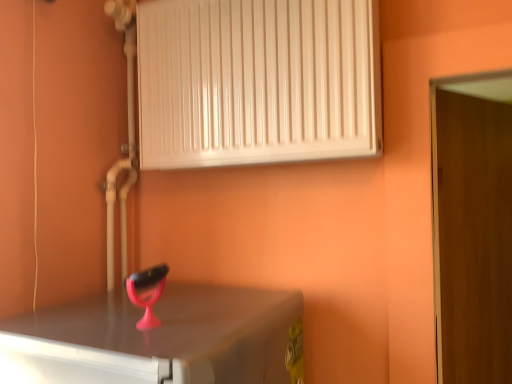
This screenshot has height=384, width=512. What do you see at coordinates (472, 226) in the screenshot? I see `wooden door at right` at bounding box center [472, 226].

At what (x,y) coordinates should I click in order to perform the action: click on wooden door at right. Please return your answer as a coordinate pair (x, y). The width and height of the screenshot is (512, 384). Looking at the image, I should click on (472, 226).

The height and width of the screenshot is (384, 512). What do you see at coordinates (257, 81) in the screenshot?
I see `white glossy radiator at upper center` at bounding box center [257, 81].

Find the location of `white glossy radiator at upper center`. white glossy radiator at upper center is located at coordinates (257, 81).

Find the location of a particular element. This screenshot has height=384, width=512. wooden door at right is located at coordinates (472, 226).

Considering the relative positions of wooden door at right and white glossy radiator at upper center in the image provided, is wooden door at right to the right of white glossy radiator at upper center from the viewer's perspective?

Yes.

Which object is closer to the camera, wooden door at right or white glossy radiator at upper center?

white glossy radiator at upper center is more forward.

Is point (463, 238) positioned behind point (237, 121)?

Yes, point (463, 238) is behind point (237, 121).

From the image's perspective, which one is positioned lower, wooden door at right or white glossy radiator at upper center?

wooden door at right is shown below in the image.

From a real-world perspective, is wooden door at right on top of white glossy radiator at upper center?

No.

Is wooden door at right thinner than white glossy radiator at upper center?

Correct, the width of wooden door at right is less than that of white glossy radiator at upper center.

Who is taller, wooden door at right or white glossy radiator at upper center?

wooden door at right.

From the picture: Is wooden door at right smaller than white glossy radiator at upper center?

Actually, wooden door at right might be larger than white glossy radiator at upper center.

In the scene shown: Is wooden door at right inside the boundaries of white glossy radiator at upper center, or outside?

wooden door at right cannot be found inside white glossy radiator at upper center.

Is wooden door at right far from white glossy radiator at upper center?

No, wooden door at right is not far from white glossy radiator at upper center.

Is wooden door at right looking in the opposite direction of white glossy radiator at upper center?

wooden door at right does not have its back to white glossy radiator at upper center.

From the picture: How many degrees apart are the facing directions of wooden door at right and white glossy radiator at upper center?

The angular difference between wooden door at right and white glossy radiator at upper center is 68.2 degrees.

At what (x,y) coordinates should I click in order to perform the action: click on radiator above the wooden door at right (from the image's perspective). Please return your answer as a coordinate pair (x, y). Looking at the image, I should click on (257, 81).

Is white glossy radiator at upper center at the left side of wooden door at right?

Indeed, white glossy radiator at upper center is positioned on the left side of wooden door at right.

Is white glossy radiator at upper center in front of or behind wooden door at right in the image?

Visually, white glossy radiator at upper center is located in front of wooden door at right.

Considering the positions of points (321, 90) and (454, 81), is point (321, 90) closer to camera compared to point (454, 81)?

No, (321, 90) is behind (454, 81).

From the image's perspective, would you say white glossy radiator at upper center is shown under wooden door at right?

Incorrect, from the image's perspective, white glossy radiator at upper center is higher than wooden door at right.

From a real-world perspective, between white glossy radiator at upper center and wooden door at right, who is vertically higher?

In real-world perspective, white glossy radiator at upper center is above.

Between white glossy radiator at upper center and wooden door at right, which one has smaller width?

With smaller width is wooden door at right.

Which of these two, white glossy radiator at upper center or wooden door at right, stands shorter?

white glossy radiator at upper center.

Is white glossy radiator at upper center bigger than wooden door at right?

No.

Based on the photo, is white glossy radiator at upper center inside the boundaries of wooden door at right, or outside?

white glossy radiator at upper center lies outside wooden door at right.

Is white glossy radiator at upper center far away from wooden door at right?

No, white glossy radiator at upper center is not far away from wooden door at right.

Looking at this image, is white glossy radiator at upper center facing away from wooden door at right?

No.

How different are the orientations of white glossy radiator at upper center and wooden door at right in degrees?

68.2 degrees separate the facing orientations of white glossy radiator at upper center and wooden door at right.

How far apart are white glossy radiator at upper center and wooden door at right?

white glossy radiator at upper center is 52.30 centimeters from wooden door at right.

At what (x,y) coordinates should I click in order to perform the action: click on door directly beneath the white glossy radiator at upper center (from a real-world perspective). Please return your answer as a coordinate pair (x, y). This screenshot has width=512, height=384. Looking at the image, I should click on [472, 226].

The height and width of the screenshot is (384, 512). In order to click on door behind the white glossy radiator at upper center in this screenshot , I will do `click(472, 226)`.

You are a GUI agent. You are given a task and a screenshot of the screen. Output one action in this format:
    pyautogui.click(x=<x>, y=<y>)
    Task: Click on the door below the white glossy radiator at upper center (from a real-world perspective)
    
    Given the screenshot: What is the action you would take?
    pyautogui.click(x=472, y=226)